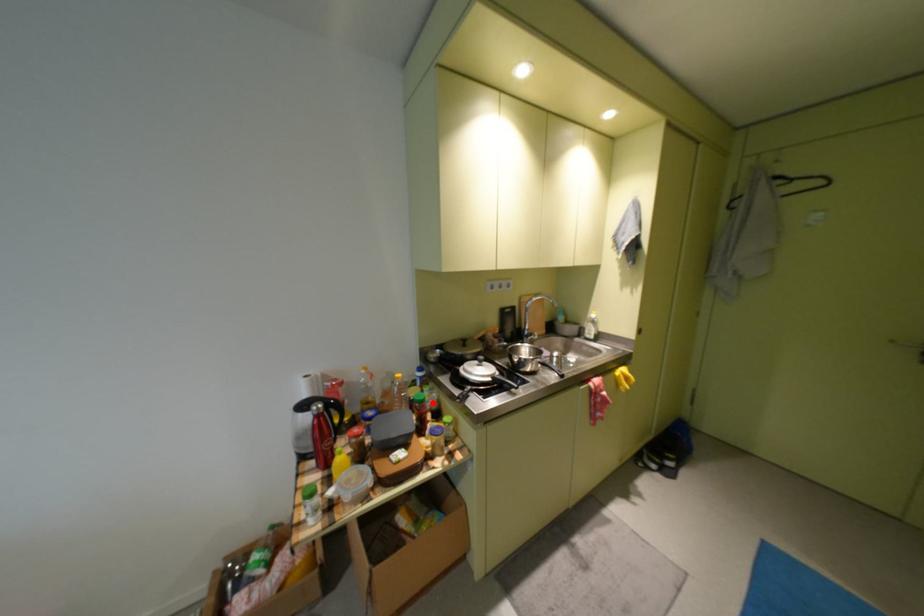
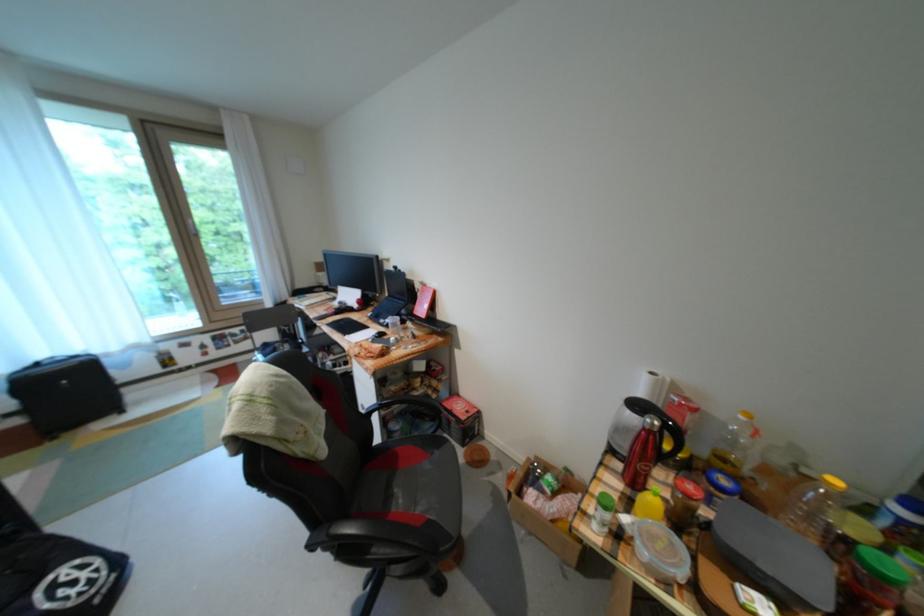
Where in the second image is the point corresponding to the highlighted location from the first image?

(898, 583)